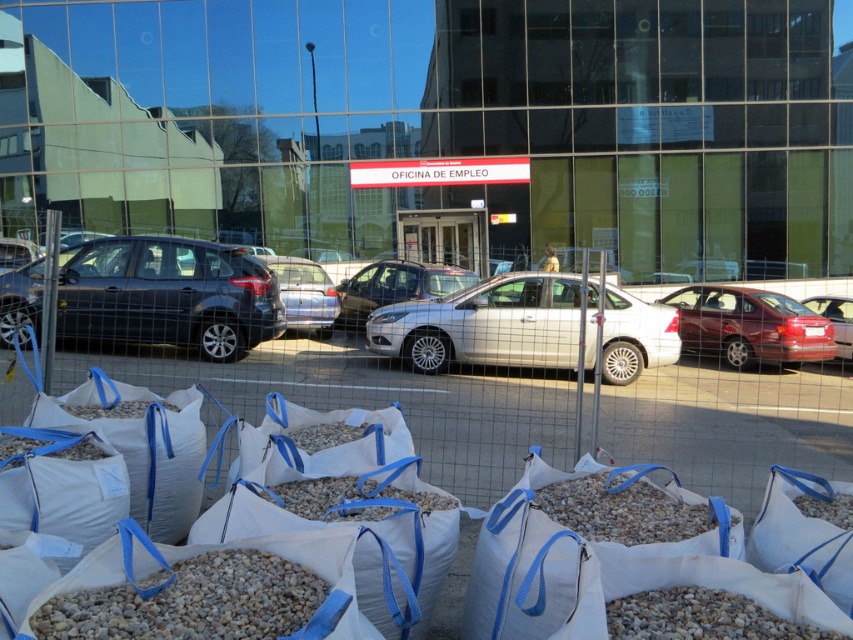
Question: Estimate the real-world distances between objects in this image. Which object is closer to the matte black hatchback at left?

Choices:
 (A) matte red car at right
 (B) gray gravel at lower left

Answer: (B)

Question: Can you confirm if matte black hatchback at left is positioned below gray gravel at lower left?

Choices:
 (A) no
 (B) yes

Answer: (A)

Question: Does matte silver sedan at center appear on the right side of matte black hatchback at left?

Choices:
 (A) yes
 (B) no

Answer: (A)

Question: Which point is farther to the camera?

Choices:
 (A) matte red car at right
 (B) white metallic car at center
 (C) gray gravel at lower left

Answer: (A)

Question: Does matte silver sedan at center have a smaller size compared to gray gravel at lower left?

Choices:
 (A) yes
 (B) no

Answer: (B)

Question: Which point is farther to the camera?

Choices:
 (A) (318, 330)
 (B) (334, 301)

Answer: (A)